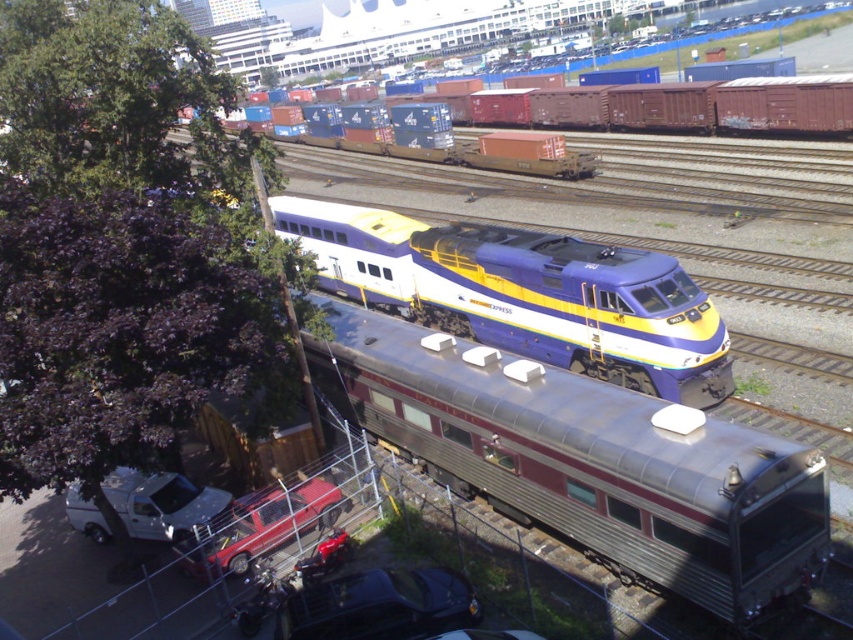
Can you confirm if metallic silver passenger train at center is positioned below metallic blue and yellow passenger train at center?

Correct, metallic silver passenger train at center is located below metallic blue and yellow passenger train at center.

Which is more to the right, metallic silver passenger train at center or metallic blue and yellow passenger train at center?

Positioned to the right is metallic blue and yellow passenger train at center.

Identify the location of metallic silver passenger train at center. (587, 460).

Can you confirm if green leafy tree at upper left is positioned to the right of white matte truck at lower left?

In fact, green leafy tree at upper left is to the left of white matte truck at lower left.

Does green leafy tree at upper left appear over white matte truck at lower left?

Yes.

At what (x,y) coordinates should I click in order to perform the action: click on green leafy tree at upper left. Please return your answer as a coordinate pair (x, y). This screenshot has width=853, height=640. Looking at the image, I should click on (109, 96).

You are a GUI agent. You are given a task and a screenshot of the screen. Output one action in this format:
    pyautogui.click(x=<x>, y=<y>)
    Task: Click on the green leafy tree at upper left
    The width and height of the screenshot is (853, 640).
    Given the screenshot: What is the action you would take?
    pyautogui.click(x=109, y=96)

Is point (405, 593) positioned behind point (300, 520)?

No, (405, 593) is closer to viewer.

Which is below, shiny black car at lower center or metallic red pickup truck at lower left?

Positioned lower is shiny black car at lower center.

Between point (397, 605) and point (231, 547), which one is positioned behind?

The point (231, 547) is more distant.

The image size is (853, 640). I want to click on shiny black car at lower center, so click(x=379, y=605).